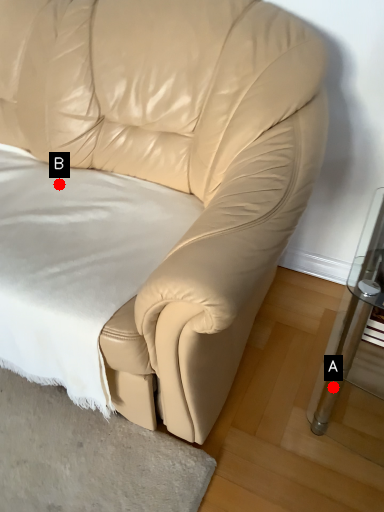
Question: Two points are circled on the image, labeled by A and B beside each circle. Which of the following is the closest to the observer?

Choices:
 (A) A is closer
 (B) B is closer

Answer: (A)